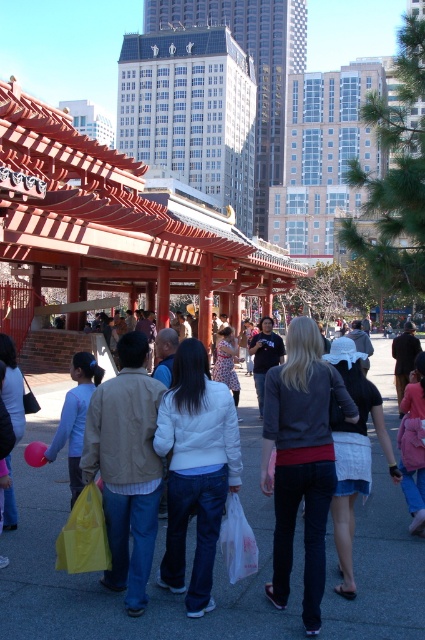
You are standing in the urban scene and see both the denim jacket at center and the dark gray sweater at center. Which clothing item is positioned to the left?

The denim jacket at center is to the left of the dark gray sweater at center.

You are standing at the pavilion and want to take a photo of both the point at coordinates (214, 529) and the point at coordinates (263, 24). Based on their positions, which point should you focus on first to ensure both are in clear view?

You should focus on the point at coordinates (214, 529) first because it is closer to the camera than the point at coordinates (263, 24). By focusing on the closer point, the farther one will likely remain in focus due to the depth of field.

You are a photographer trying to capture a shot of the white matte jacket at center and the yellow plastic bag at lower left. If you want to ensure both objects are in the frame without cropping, which object should you position closer to the camera?

The white matte jacket at center has a larger width than the yellow plastic bag at lower left, so you should position the white matte jacket at center closer to the camera to ensure both fit in the frame without cropping.